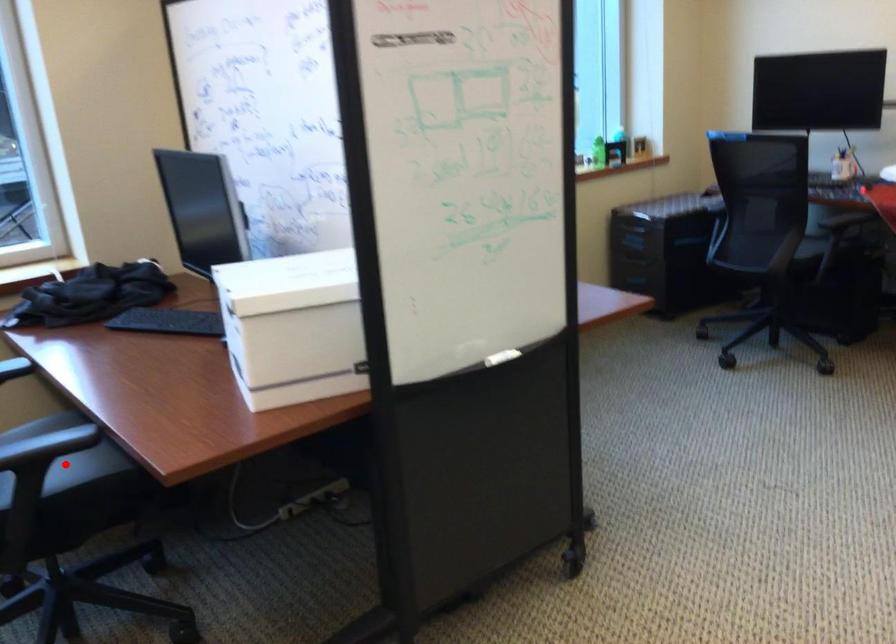
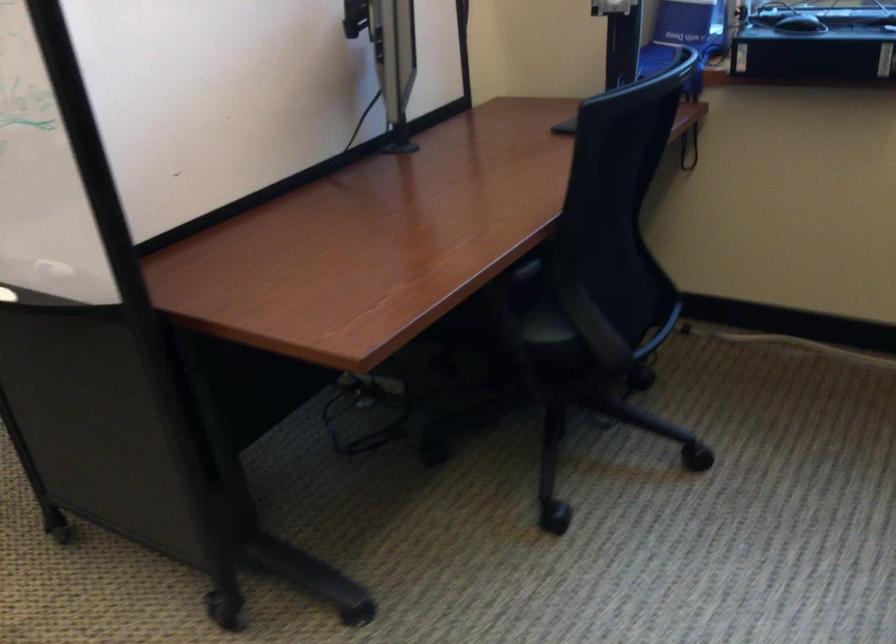
Question: I am providing you with two images of the same scene from different viewpoints. A red point is marked on the first image. Is the red point's position out of view in image 2?

Choices:
 (A) Yes
 (B) No

Answer: (A)